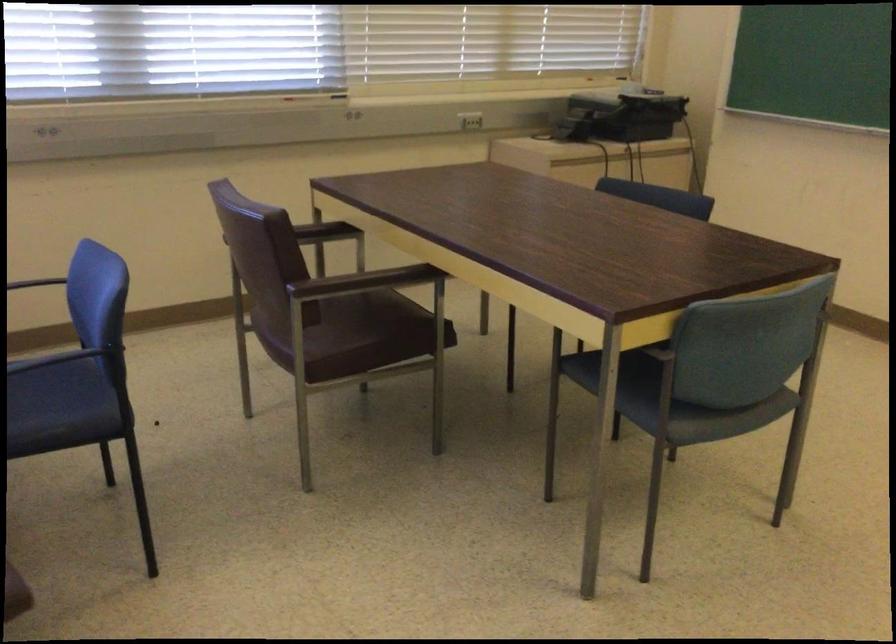
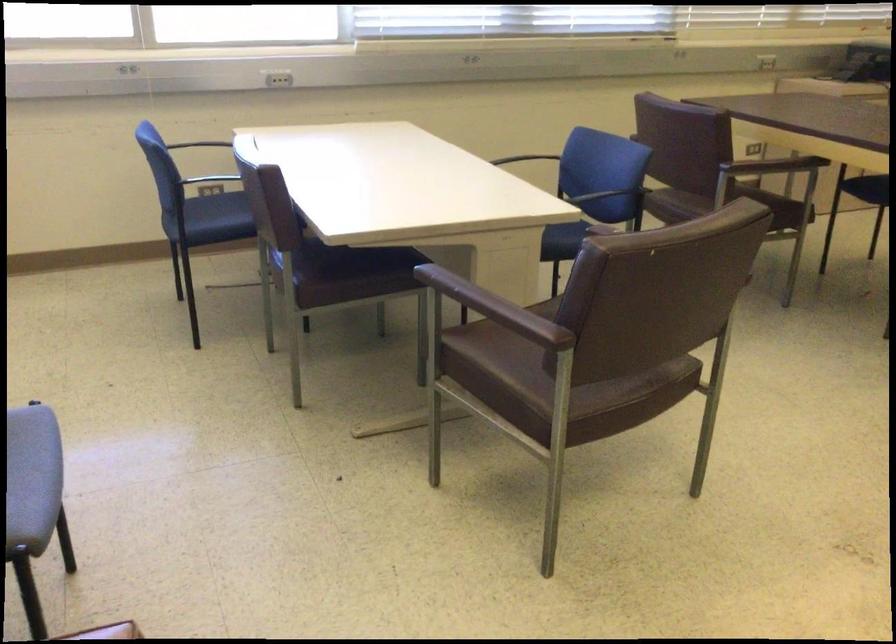
Question: I am providing you with two images of the same scene from different viewpoints. After the viewpoint changes to image2, which objects are now occluded?

Choices:
 (A) brown chair armrest
 (B) small toy vehicle
 (C) brown chair sitting surface
 (D) black chair armrest

Answer: (D)